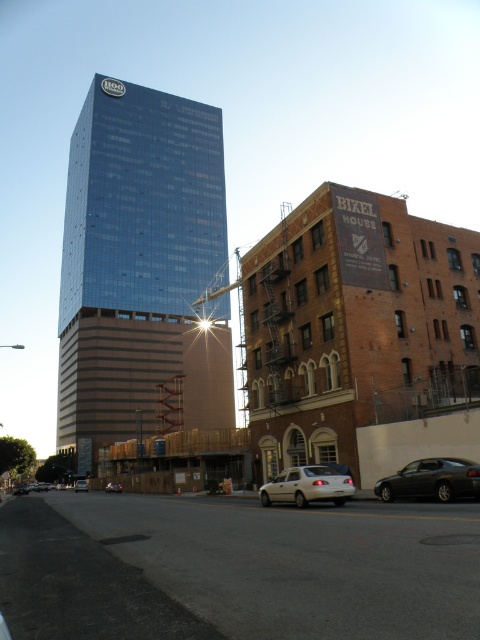
Is point (309, 486) positioned behind point (113, 484)?

No, it is in front of (113, 484).

The image size is (480, 640). Find the location of `white matte sedan at lower center`. white matte sedan at lower center is located at coordinates (308, 484).

Find the location of a particular element. The width and height of the screenshot is (480, 640). white matte sedan at lower center is located at coordinates [308, 484].

Does metallic gray sedan at lower right appear on the right side of silver metallic sedan at lower left?

Indeed, metallic gray sedan at lower right is positioned on the right side of silver metallic sedan at lower left.

Who is more distant from viewer, (418, 460) or (22, 486)?

Point (22, 486)

You are a GUI agent. You are given a task and a screenshot of the screen. Output one action in this format:
    pyautogui.click(x=<x>, y=<y>)
    Task: Click on the metallic gray sedan at lower right
    
    Given the screenshot: What is the action you would take?
    pyautogui.click(x=432, y=480)

Can you confirm if shiny glass skyscraper at center is positioned above matte silver sedan at center?

Indeed, shiny glass skyscraper at center is positioned over matte silver sedan at center.

Does shiny glass skyscraper at center come behind matte silver sedan at center?

Yes, it is.

Which is in front, point (106, 403) or point (115, 484)?

Point (115, 484) is in front.

Locate an element on the screen. shiny glass skyscraper at center is located at coordinates (141, 269).